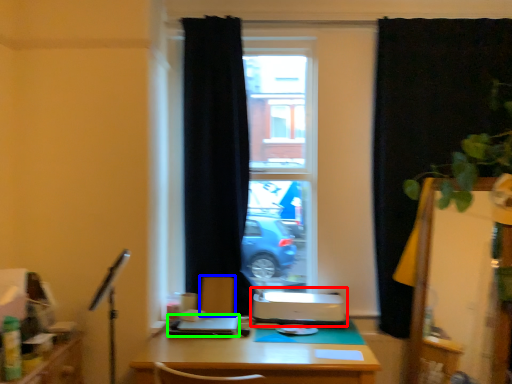
Question: Considering the real-world distances, which object is closest to printer (highlighted by a red box)? armchair (highlighted by a blue box) or laptop (highlighted by a green box).

Choices:
 (A) armchair
 (B) laptop

Answer: (A)